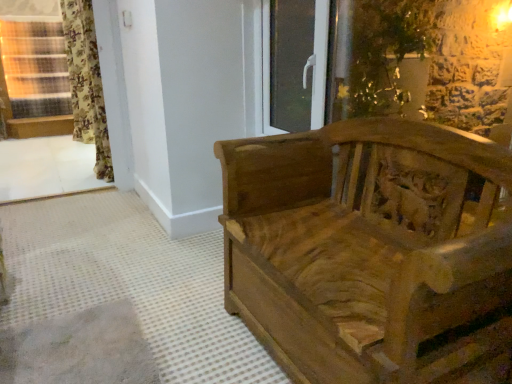
Question: Would you say wooden window frame at lower left is outside floral fabric curtain at left?

Choices:
 (A) no
 (B) yes

Answer: (B)

Question: From a real-world perspective, is wooden window frame at lower left below floral fabric curtain at left?

Choices:
 (A) yes
 (B) no

Answer: (A)

Question: Is wooden window frame at lower left to the left of floral fabric curtain at left from the viewer's perspective?

Choices:
 (A) no
 (B) yes

Answer: (B)

Question: Can floral fabric curtain at left be found inside wooden window frame at lower left?

Choices:
 (A) no
 (B) yes

Answer: (A)

Question: Is wooden window frame at lower left further to the viewer compared to floral fabric curtain at left?

Choices:
 (A) yes
 (B) no

Answer: (B)

Question: Is wooden window frame at lower left shorter than floral fabric curtain at left?

Choices:
 (A) no
 (B) yes

Answer: (B)

Question: Considering the relative sizes of transparent glass door at upper center and wooden carved bench at right in the image provided, is transparent glass door at upper center wider than wooden carved bench at right?

Choices:
 (A) yes
 (B) no

Answer: (B)

Question: Can you confirm if transparent glass door at upper center is shorter than wooden carved bench at right?

Choices:
 (A) yes
 (B) no

Answer: (A)

Question: Can you confirm if transparent glass door at upper center is positioned to the left of wooden carved bench at right?

Choices:
 (A) yes
 (B) no

Answer: (A)

Question: Considering the relative sizes of transparent glass door at upper center and wooden carved bench at right in the image provided, is transparent glass door at upper center thinner than wooden carved bench at right?

Choices:
 (A) no
 (B) yes

Answer: (B)

Question: Does transparent glass door at upper center turn towards wooden carved bench at right?

Choices:
 (A) no
 (B) yes

Answer: (A)

Question: Is the surface of transparent glass door at upper center in direct contact with wooden carved bench at right?

Choices:
 (A) no
 (B) yes

Answer: (A)

Question: Could you tell me if transparent glass door at upper center is turned towards wooden window frame at lower left?

Choices:
 (A) yes
 (B) no

Answer: (B)